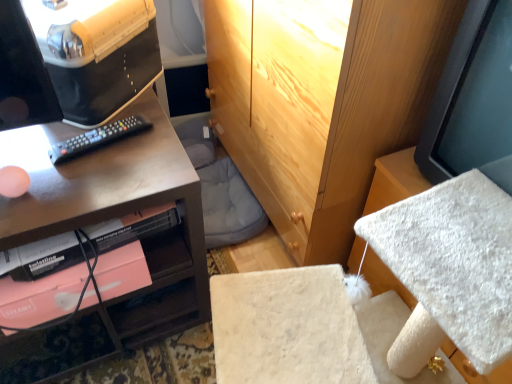
Find the location of a particular element. The height and width of the screenshot is (384, 512). unoccupied area behind black plastic remote at left is located at coordinates (124, 111).